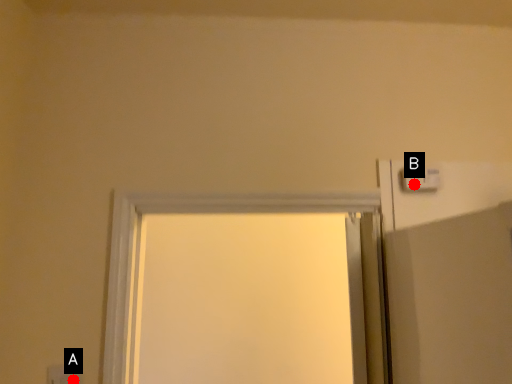
Question: Two points are circled on the image, labeled by A and B beside each circle. Which of the following is the closest to the observer?

Choices:
 (A) A is closer
 (B) B is closer

Answer: (A)